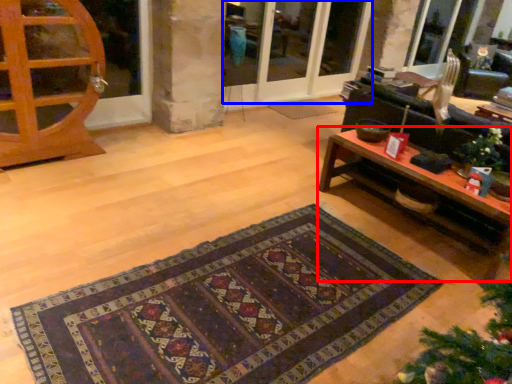
Question: Which object appears farthest to the camera in this image, table (highlighted by a red box) or screen door (highlighted by a blue box)?

Choices:
 (A) table
 (B) screen door

Answer: (B)